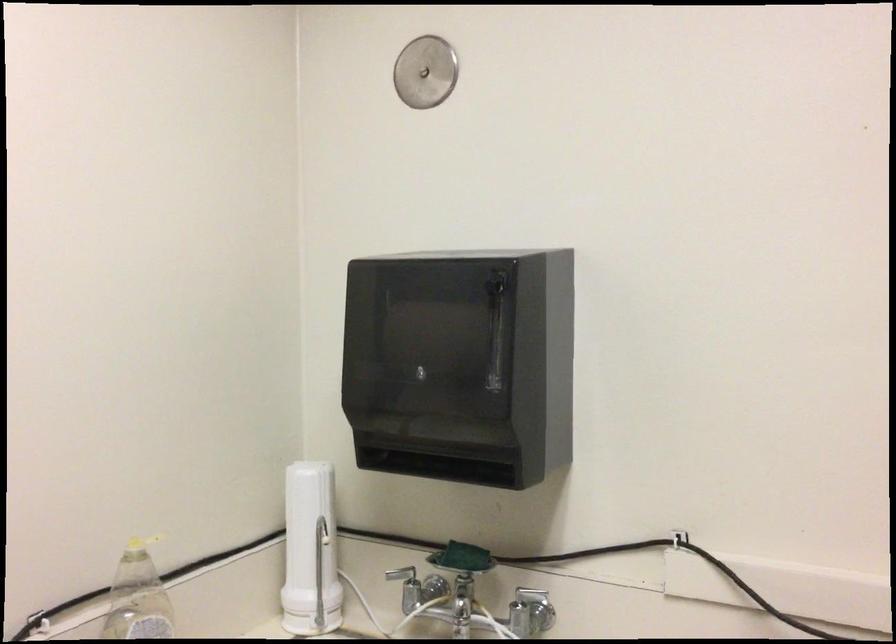
Where would you push the yellow dispenser pump? Please return your answer as a coordinate pair (x, y).

(309, 551)